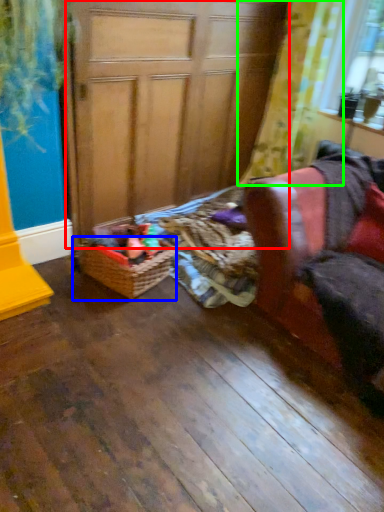
Question: Which object is the closest to the screen door (highlighted by a red box)? Choose among these: basket (highlighted by a blue box) or curtain (highlighted by a green box).

Choices:
 (A) basket
 (B) curtain

Answer: (B)